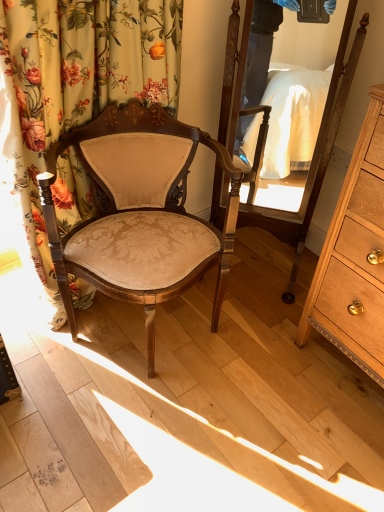
The image size is (384, 512). In order to click on vacant space in front of floral fabric curtain at left in this screenshot , I will do `click(102, 397)`.